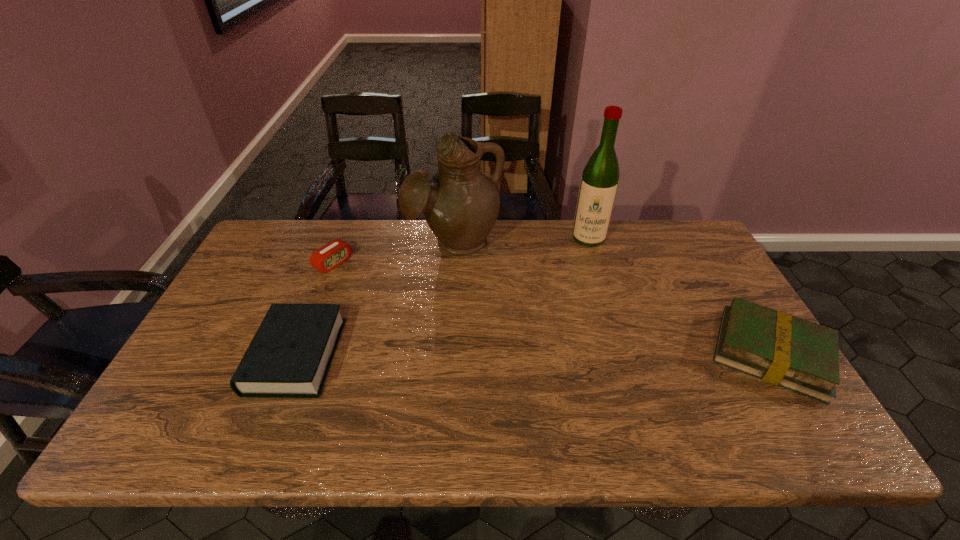
The image size is (960, 540). In order to click on Bible positioned at the near edge in this screenshot , I will do `click(290, 355)`.

You are a GUI agent. You are given a task and a screenshot of the screen. Output one action in this format:
    pyautogui.click(x=<x>, y=<y>)
    Task: Click on the book situated at the near edge
    
    Given the screenshot: What is the action you would take?
    pyautogui.click(x=787, y=351)

Find the location of `object that is at the right edge`. object that is at the right edge is located at coordinates (787, 351).

Locate an element on the screen. This screenshot has width=960, height=540. object present at the near right corner is located at coordinates (787, 351).

In the image, there is a desktop. What are the coordinates of `vacant region at the far edge` in the screenshot? It's located at (410, 233).

In the image, there is a desktop. Where is `blank space at the near edge`? The height and width of the screenshot is (540, 960). blank space at the near edge is located at coordinates (412, 401).

This screenshot has height=540, width=960. In order to click on vacant space at the left edge of the desktop in this screenshot , I will do `click(252, 306)`.

The width and height of the screenshot is (960, 540). In the image, there is a desktop. Identify the location of vacant space at the right edge. (694, 312).

The height and width of the screenshot is (540, 960). Find the location of `vacant area at the far right corner of the desktop`. vacant area at the far right corner of the desktop is located at coordinates (697, 260).

Locate an element on the screen. vacant area that lies between the book and the alarm clock is located at coordinates (552, 308).